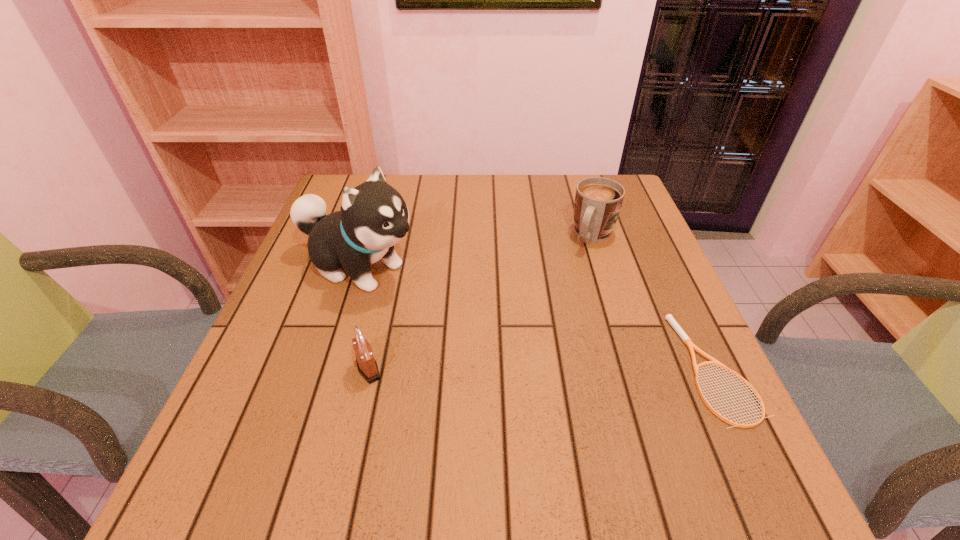
Where is `free space between the mug and the tallest object`? The height and width of the screenshot is (540, 960). free space between the mug and the tallest object is located at coordinates (476, 252).

This screenshot has width=960, height=540. I want to click on empty space that is in between the padlock and the mug, so click(481, 302).

Find the location of a particular element. vacant space in between the rightmost object and the tallest object is located at coordinates (537, 318).

Identify the location of vacant space in between the puppy and the second object from right to left. (476, 252).

This screenshot has width=960, height=540. In order to click on vacant region between the mug and the tennis racket in this screenshot , I will do [x=655, y=302].

The width and height of the screenshot is (960, 540). What are the coordinates of `unoccupied position between the padlock and the mug` in the screenshot? It's located at (481, 302).

What are the coordinates of `object that is the second nearest to the second object from right to left` in the screenshot? It's located at (373, 217).

Identify which object is located as the nearest to the shortest object. Please provide its 2D coordinates. Your answer should be formatted as a tuple, i.e. [(x, y)], where the tuple contains the x and y coordinates of a point satisfying the conditions above.

[(598, 201)]

The height and width of the screenshot is (540, 960). In order to click on free location that satisfies the following two spatial constraints: 1. on the front side of the rightmost object; 2. on the left side of the mug in this screenshot , I will do `click(636, 368)`.